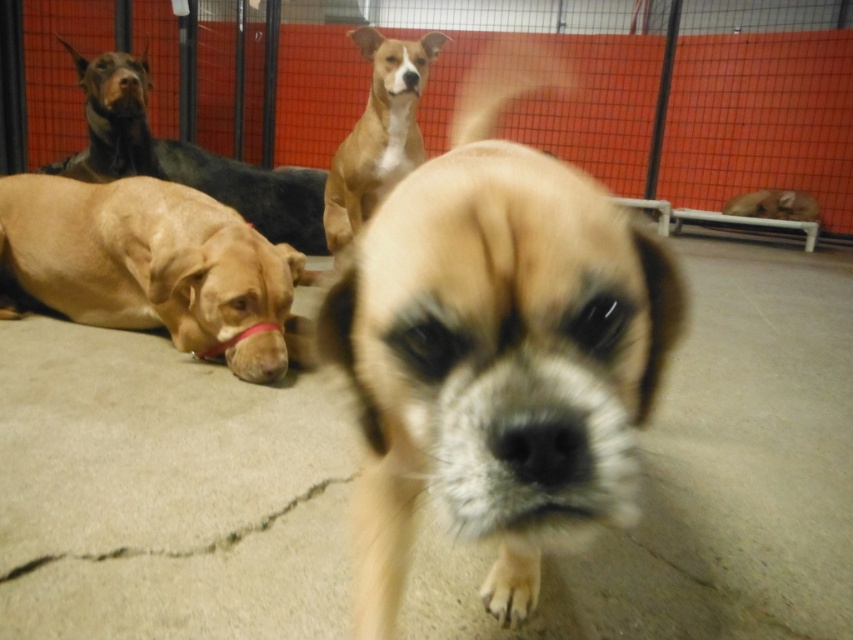
Question: Among these points, which one is farthest from the camera?

Choices:
 (A) (132, 76)
 (B) (318, 236)

Answer: (B)

Question: Which point is closer to the camera?

Choices:
 (A) brown smooth dog at upper center
 (B) brown matte nose at center
 (C) brown smooth coat at left

Answer: (B)

Question: Which point is farther from the camera taking this photo?

Choices:
 (A) (531, 426)
 (B) (349, 218)
 (C) (170, 337)
 (D) (103, 90)

Answer: (D)

Question: Is black matte nose at center in front of black smooth nose at upper left?

Choices:
 (A) yes
 (B) no

Answer: (A)

Question: Is light brown fur at center further to the viewer compared to brown matte nose at center?

Choices:
 (A) no
 (B) yes

Answer: (A)

Question: Can you confirm if brown smooth dog at lower left is bigger than brown smooth dog at upper center?

Choices:
 (A) yes
 (B) no

Answer: (A)